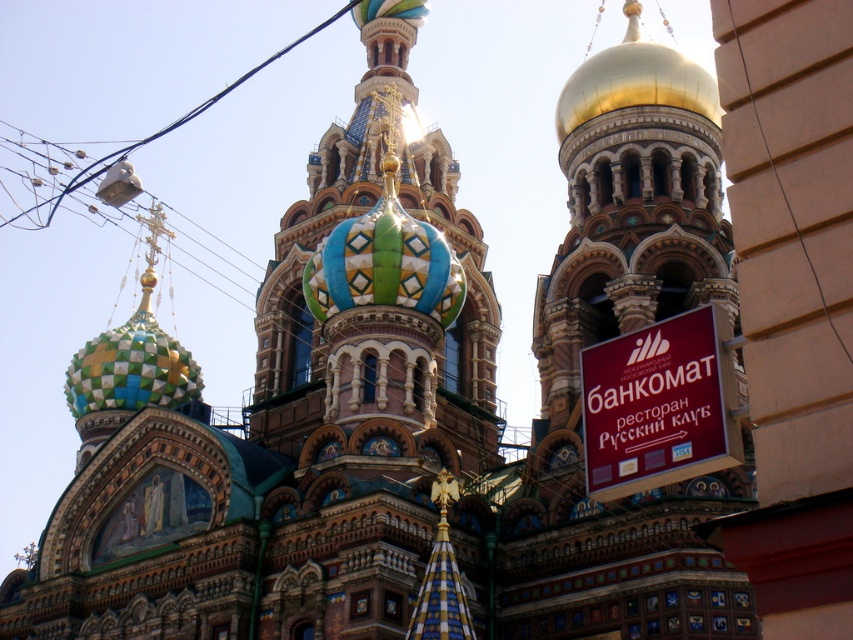
Can you confirm if maroon wooden sign at right is shorter than black wire at right?

Correct, maroon wooden sign at right is not as tall as black wire at right.

Who is shorter, maroon wooden sign at right or black wire at right?

maroon wooden sign at right is shorter.

Where is `maroon wooden sign at right`? This screenshot has width=853, height=640. maroon wooden sign at right is located at coordinates (659, 404).

In the scene shown: Can you confirm if white plastic bag at upper left is shorter than black wire at right?

In fact, white plastic bag at upper left may be taller than black wire at right.

Which is behind, point (86, 177) or point (817, 291)?

The point (86, 177) is behind.

Is point (138, 140) positioned after point (747, 84)?

Yes, it is behind point (747, 84).

Find the location of a particular element. The width and height of the screenshot is (853, 640). white plastic bag at upper left is located at coordinates (167, 124).

Looking at this image, is maroon wooden sign at right bigger than white plastic bag at upper left?

No.

Is point (592, 428) farther from camera compared to point (106, 157)?

No, (592, 428) is closer to viewer.

Locate an element on the screen. The width and height of the screenshot is (853, 640). maroon wooden sign at right is located at coordinates (659, 404).